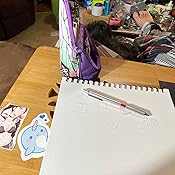
The height and width of the screenshot is (175, 175). Find the location of `sticker`. sticker is located at coordinates (19, 139).